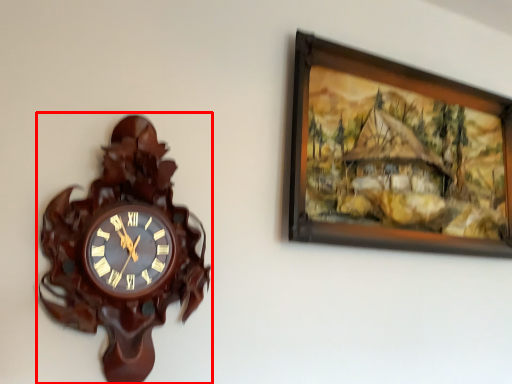
Question: From the image's perspective, what is the correct spatial positioning of wall clock (annotated by the red box) in reference to picture frame?

Choices:
 (A) below
 (B) above

Answer: (A)